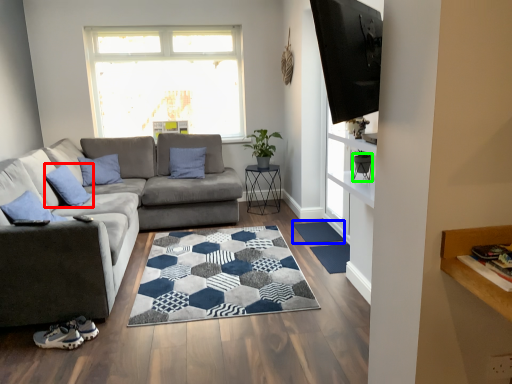
Question: Based on their relative distances, which object is farther from pillow (highlighted by a red box)? Choose from doormat (highlighted by a blue box) and chair (highlighted by a green box).

Choices:
 (A) doormat
 (B) chair

Answer: (B)